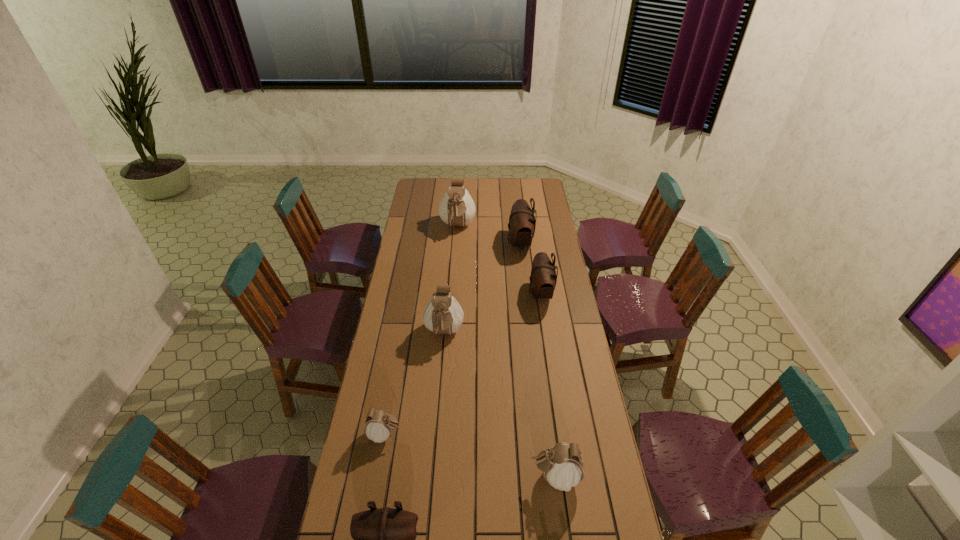
I want to click on blank area located 0.130m on the front-facing side of the second nearest object, so click(x=490, y=476).

Where is `free space located 0.200m on the front-facing side of the third farthest white pouch`? Image resolution: width=960 pixels, height=540 pixels. free space located 0.200m on the front-facing side of the third farthest white pouch is located at coordinates (460, 435).

Identify the location of object that is at the left edge. (378, 427).

I want to click on vacant region at the far edge of the desktop, so click(472, 186).

Locate an element on the screen. vacant space at the left edge of the desktop is located at coordinates (407, 408).

Where is `vacant region at the right edge of the desktop`? The height and width of the screenshot is (540, 960). vacant region at the right edge of the desktop is located at coordinates (561, 259).

I want to click on blank area at the far right corner, so click(x=529, y=197).

The image size is (960, 540). I want to click on free spot between the fifth nearest pouch and the second smallest white pouch, so coord(548,385).

You are a GUI agent. You are given a task and a screenshot of the screen. Output one action in this format:
    pyautogui.click(x=<x>, y=<y>)
    Task: Click on the vacant space that's between the farthest white pouch and the second nearest brown pouch
    The image size is (960, 540).
    Given the screenshot: What is the action you would take?
    pyautogui.click(x=499, y=260)

Locate an element on the screen. free spot between the fourth nearest pouch and the farthest brown pouch is located at coordinates (482, 288).